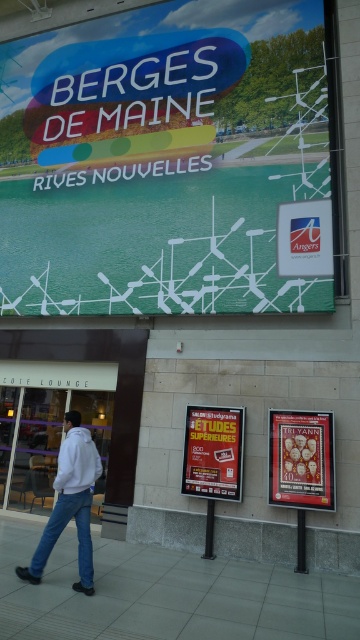
Is matte white oars at upper center to the left of metallic gold poster at center from the viewer's perspective?

Yes, matte white oars at upper center is to the left of metallic gold poster at center.

Who is positioned more to the left, matte white oars at upper center or metallic gold poster at center?

Positioned to the left is matte white oars at upper center.

Locate an element on the screen. matte white oars at upper center is located at coordinates (162, 157).

Can you confirm if matte white oars at upper center is smaller than denim at lower left?

No.

Is matte white oars at upper center to the right of denim at lower left from the viewer's perspective?

Indeed, matte white oars at upper center is positioned on the right side of denim at lower left.

This screenshot has width=360, height=640. I want to click on matte white oars at upper center, so click(x=162, y=157).

Does matte white oars at upper center have a greater height compared to gray tile pavement at lower center?

Correct, matte white oars at upper center is much taller as gray tile pavement at lower center.

Between matte white oars at upper center and gray tile pavement at lower center, which one appears on the left side from the viewer's perspective?

Positioned to the left is matte white oars at upper center.

The width and height of the screenshot is (360, 640). I want to click on matte white oars at upper center, so click(x=162, y=157).